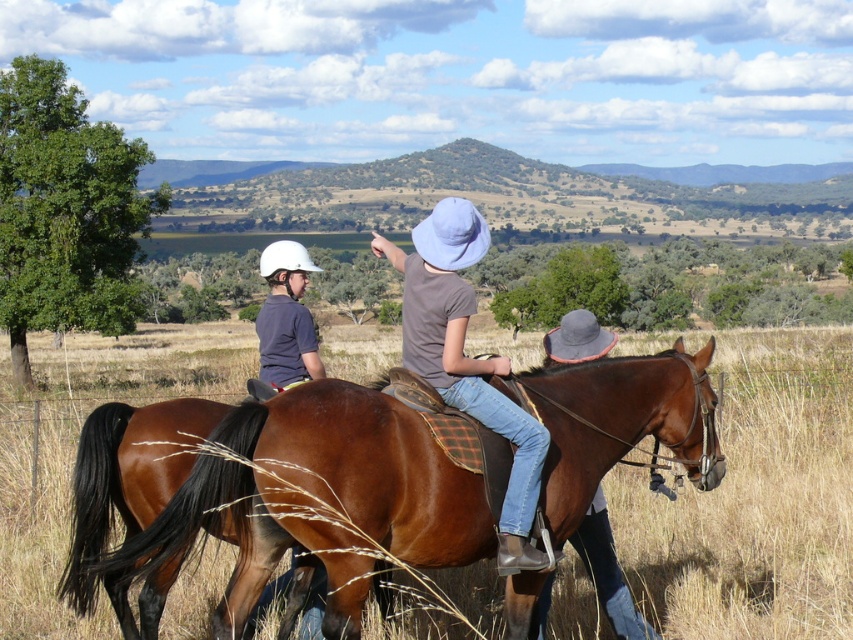
Describe the element at coordinates (317, 500) in the screenshot. I see `shiny brown horse at center` at that location.

Which is more to the left, shiny brown horse at center or matte white helmet at left?

matte white helmet at left

Is point (216, 426) positioned before point (277, 340)?

Yes.

Image resolution: width=853 pixels, height=640 pixels. I want to click on shiny brown horse at center, so click(317, 500).

Is the position of shiny brown horse at center more distant than that of denim jeans at center?

No.

Who is more forward, (671,413) or (428,337)?

Positioned in front is point (428,337).

At what (x,y) coordinates should I click in order to perform the action: click on shiny brown horse at center. Please return your answer as a coordinate pair (x, y). The image size is (853, 640). Looking at the image, I should click on (317, 500).

Consider the image. Who is more distant from viewer, (436, 225) or (280, 266)?

The point (280, 266) is more distant.

Is denim jeans at center above matte white helmet at left?

Yes.

Between point (521, 561) and point (286, 365), which one is positioned in front?

Point (521, 561) is in front.

The height and width of the screenshot is (640, 853). In order to click on denim jeans at center in this screenshot , I will do `click(467, 358)`.